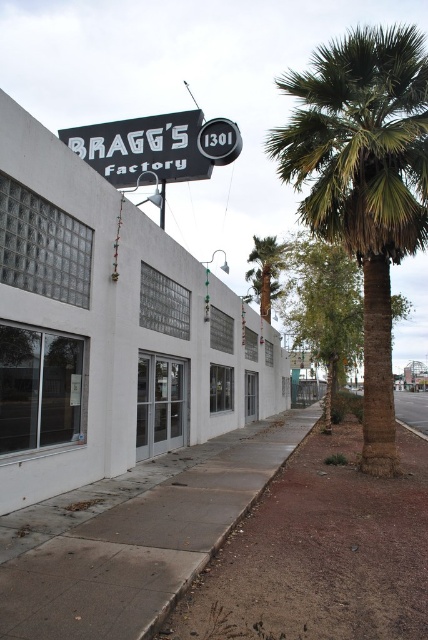
You are standing in front of Bragg Factory and want to take a photo of the black plastic sign at upper center and the green leafy palm tree at center. Which object will appear larger in the photo?

The green leafy palm tree at center will appear larger in the photo because it is bigger than the black plastic sign at upper center.